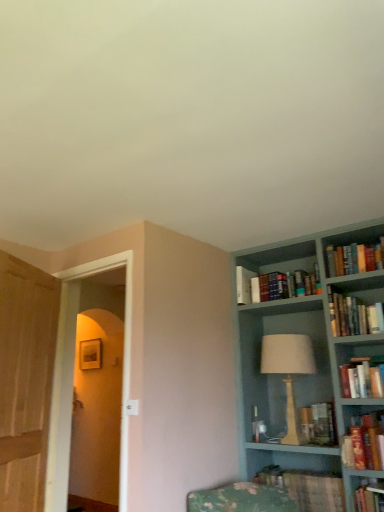
Question: From a real-world perspective, is wooden door at left, the first glass door when ordered from left to right, beneath transparent glass door at left, which appears as the 2th glass door when viewed from the left?

Choices:
 (A) yes
 (B) no

Answer: (A)

Question: Can you confirm if wooden door at left, positioned as the 2th glass door in right-to-left order, is positioned to the left of transparent glass door at left, the 1th glass door positioned from the right?

Choices:
 (A) yes
 (B) no

Answer: (A)

Question: Is transparent glass door at left, which appears as the 2th glass door when viewed from the left, at the back of wooden door at left, the first glass door when ordered from left to right?

Choices:
 (A) no
 (B) yes

Answer: (B)

Question: From the image's perspective, would you say wooden door at left, the first glass door when ordered from left to right, is positioned over transparent glass door at left, the 1th glass door positioned from the right?

Choices:
 (A) yes
 (B) no

Answer: (A)

Question: Does wooden door at left, positioned as the 2th glass door in right-to-left order, turn towards transparent glass door at left, the 1th glass door positioned from the right?

Choices:
 (A) no
 (B) yes

Answer: (B)

Question: From the image's perspective, relative to teal painted wood bookcase at right, is white matte paperback book at upper right above or below?

Choices:
 (A) below
 (B) above

Answer: (B)

Question: Based on their positions, is white matte paperback book at upper right located to the left or right of teal painted wood bookcase at right?

Choices:
 (A) right
 (B) left

Answer: (B)

Question: From a real-world perspective, is white matte paperback book at upper right physically located above or below teal painted wood bookcase at right?

Choices:
 (A) below
 (B) above

Answer: (B)

Question: In terms of width, does white matte paperback book at upper right look wider or thinner when compared to teal painted wood bookcase at right?

Choices:
 (A) wide
 (B) thin

Answer: (B)

Question: Which is correct: transparent glass door at left, which appears as the 2th glass door when viewed from the left, is inside white matte paperback book at upper right, or outside of it?

Choices:
 (A) inside
 (B) outside

Answer: (B)

Question: From a real-world perspective, relative to white matte paperback book at upper right, is transparent glass door at left, which appears as the 2th glass door when viewed from the left, vertically above or below?

Choices:
 (A) above
 (B) below

Answer: (B)

Question: In the image, is transparent glass door at left, which appears as the 2th glass door when viewed from the left, on the left side or the right side of white matte paperback book at upper right?

Choices:
 (A) left
 (B) right

Answer: (A)

Question: Is point (56, 446) closer or farther from the camera than point (253, 273)?

Choices:
 (A) closer
 (B) farther

Answer: (A)

Question: In terms of height, does white matte paperback book at upper right look taller or shorter compared to hardcover books at upper right, which appears as the fifth book when ordered from the bottom?

Choices:
 (A) tall
 (B) short

Answer: (A)

Question: From the image's perspective, is white matte paperback book at upper right positioned above or below hardcover books at upper right, which appears as the fifth book when ordered from the bottom?

Choices:
 (A) above
 (B) below

Answer: (B)